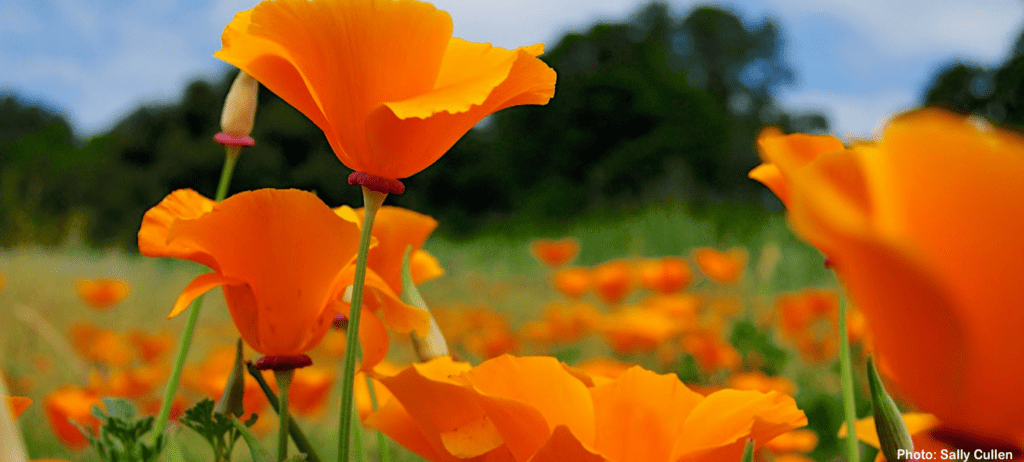
Identify the location of receptacle. (382, 201).